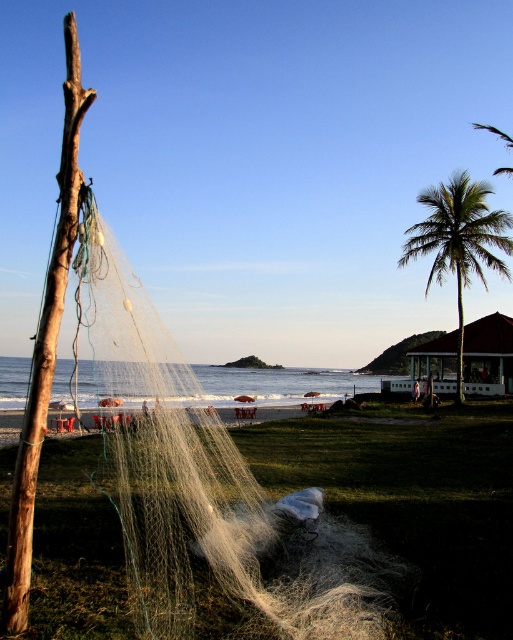
You are standing at the point marked as point (489,346) in the image. What object are you facing?

The point (489,346) corresponds to the brown wooden hut at center right, so you are facing the brown wooden hut at center right.